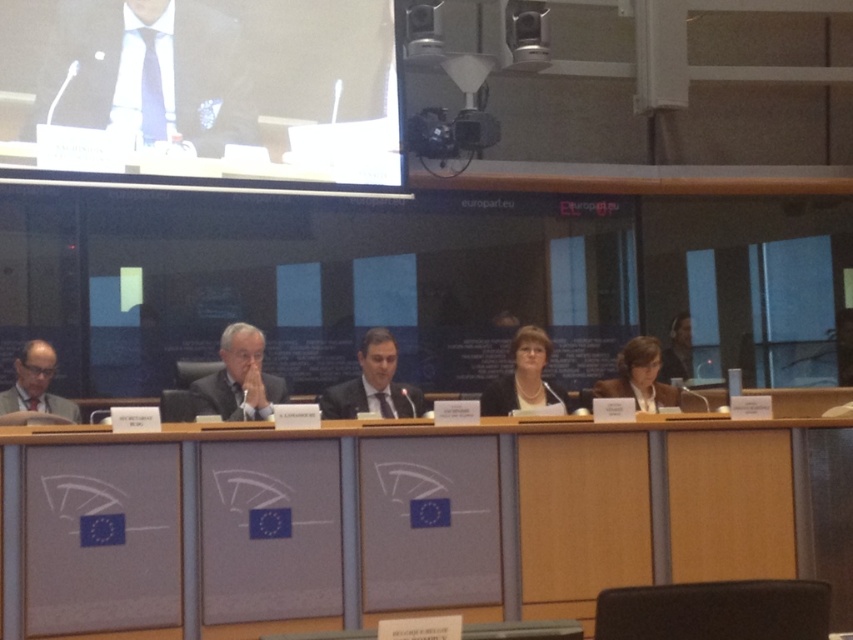
Question: Can you confirm if matte black suit at upper center is thinner than dark suit at center?

Choices:
 (A) yes
 (B) no

Answer: (B)

Question: Is matte black suit at center positioned behind dark brown leather jacket at lower right?

Choices:
 (A) yes
 (B) no

Answer: (B)

Question: Which point is closer to the camera?

Choices:
 (A) matte black suit at center
 (B) matte black suit at upper center
 (C) matte black jacket at center
 (D) matte black suit at left

Answer: (B)

Question: Does matte black screen at upper center appear on the right side of dark suit at center?

Choices:
 (A) no
 (B) yes

Answer: (A)

Question: Which of these objects is positioned farthest from the dark suit at center?

Choices:
 (A) matte black suit at left
 (B) matte gray panel at center

Answer: (A)

Question: Estimate the real-world distances between objects in this image. Which object is farther from the matte black screen at upper center?

Choices:
 (A) matte black suit at left
 (B) dark suit at center
 (C) matte black suit at center

Answer: (A)